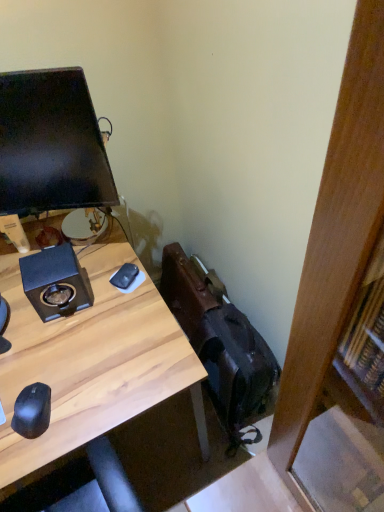
Question: Can you confirm if wooden desk at center is positioned to the right of black matte speaker at upper left?

Choices:
 (A) yes
 (B) no

Answer: (B)

Question: Is wooden desk at center thinner than black matte speaker at upper left?

Choices:
 (A) no
 (B) yes

Answer: (A)

Question: From a real-world perspective, does wooden desk at center sit lower than black matte speaker at upper left?

Choices:
 (A) no
 (B) yes

Answer: (B)

Question: From the image's perspective, is wooden desk at center under black matte speaker at upper left?

Choices:
 (A) yes
 (B) no

Answer: (A)

Question: Considering the relative sizes of wooden desk at center and black matte speaker at upper left in the image provided, is wooden desk at center wider than black matte speaker at upper left?

Choices:
 (A) yes
 (B) no

Answer: (A)

Question: Considering the relative sizes of wooden desk at center and black matte speaker at upper left in the image provided, is wooden desk at center shorter than black matte speaker at upper left?

Choices:
 (A) yes
 (B) no

Answer: (B)

Question: Can you confirm if black matte speaker at upper left is wider than wooden desk at center?

Choices:
 (A) no
 (B) yes

Answer: (A)

Question: From a real-world perspective, is black matte speaker at upper left physically below wooden desk at center?

Choices:
 (A) no
 (B) yes

Answer: (A)

Question: Considering the relative positions of black matte speaker at upper left and wooden desk at center in the image provided, is black matte speaker at upper left to the right of wooden desk at center from the viewer's perspective?

Choices:
 (A) yes
 (B) no

Answer: (A)

Question: Does black matte speaker at upper left come in front of wooden desk at center?

Choices:
 (A) yes
 (B) no

Answer: (B)

Question: Is black matte speaker at upper left thinner than wooden desk at center?

Choices:
 (A) no
 (B) yes

Answer: (B)

Question: Is black matte speaker at upper left facing towards wooden desk at center?

Choices:
 (A) yes
 (B) no

Answer: (B)

Question: Does black matte mouse at center, which is counted as the second mouse, starting from the bottom, have a greater width compared to black matte speaker at upper left?

Choices:
 (A) yes
 (B) no

Answer: (B)